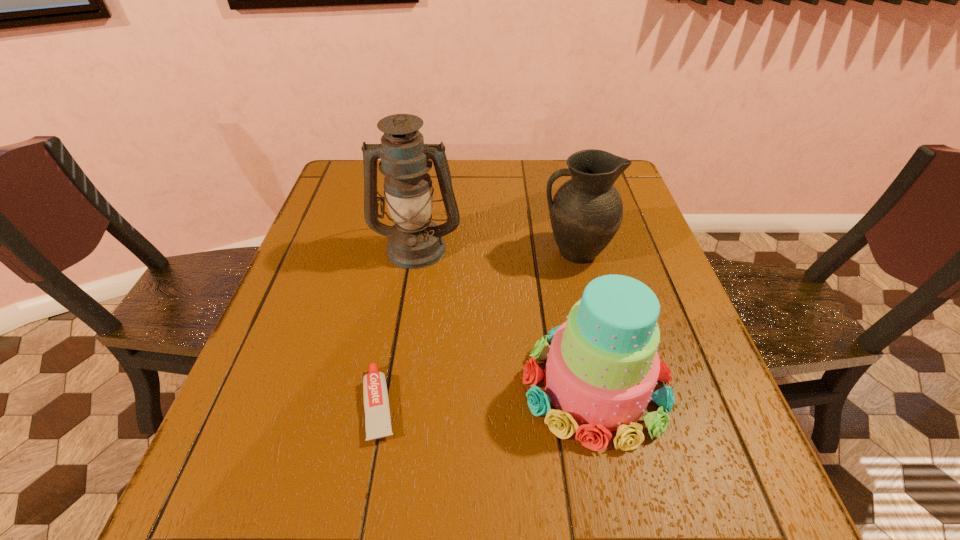
Locate an element on the screen. The width and height of the screenshot is (960, 540). unoccupied position between the cake and the oil lamp is located at coordinates (506, 316).

Locate an element on the screen. This screenshot has height=540, width=960. free space between the cake and the oil lamp is located at coordinates (506, 316).

Where is `free space between the pitcher and the oil lamp`? Image resolution: width=960 pixels, height=540 pixels. free space between the pitcher and the oil lamp is located at coordinates (495, 249).

At what (x,y) coordinates should I click in order to perform the action: click on free spot between the toothpaste and the pitcher. Please return your answer as a coordinate pair (x, y). Looking at the image, I should click on (477, 328).

Select which object is the second closest to the cake. Please provide its 2D coordinates. Your answer should be formatted as a tuple, i.e. [(x, y)], where the tuple contains the x and y coordinates of a point satisfying the conditions above.

[(376, 403)]

Identify which object is the second nearest to the oil lamp. Please provide its 2D coordinates. Your answer should be formatted as a tuple, i.e. [(x, y)], where the tuple contains the x and y coordinates of a point satisfying the conditions above.

[(602, 366)]

Locate an element on the screen. Image resolution: width=960 pixels, height=540 pixels. free space that satisfies the following two spatial constraints: 1. on the side of the pitcher with the handle; 2. on the front side of the cake is located at coordinates (607, 385).

This screenshot has width=960, height=540. I want to click on blank space that satisfies the following two spatial constraints: 1. on the side of the pitcher with the handle; 2. on the front side of the shortest object, so click(x=612, y=404).

Find the location of a particular element. vacant point that satisfies the following two spatial constraints: 1. on the side of the pitcher with the handle; 2. on the front side of the cake is located at coordinates click(607, 385).

At what (x,y) coordinates should I click in order to perform the action: click on vacant area in the image that satisfies the following two spatial constraints: 1. on the back side of the toothpaste; 2. on the left side of the cake. Please return your answer as a coordinate pair (x, y). This screenshot has width=960, height=540. Looking at the image, I should click on (383, 385).